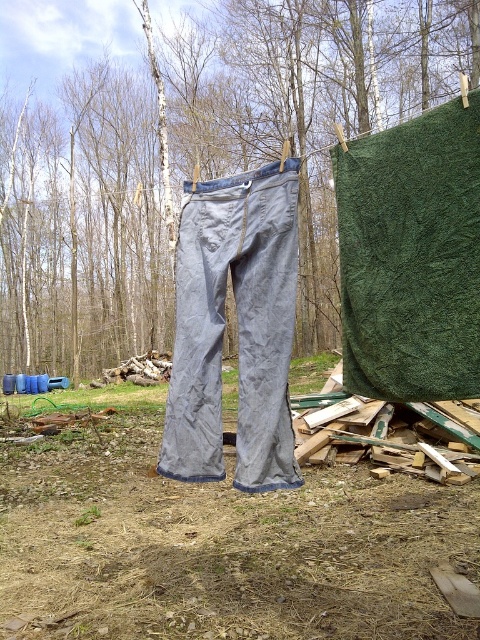
Question: In this image, where is green fabric at center located relative to gray cotton pants at center?

Choices:
 (A) below
 (B) above

Answer: (B)

Question: Among these objects, which one is nearest to the camera?

Choices:
 (A) green fabric at center
 (B) green textured fabric at upper right

Answer: (B)

Question: Which is nearer to the green fabric at center?

Choices:
 (A) gray cotton pants at center
 (B) green textured fabric at upper right

Answer: (A)

Question: Which is nearer to the green fabric at center?

Choices:
 (A) green textured fabric at upper right
 (B) gray cotton pants at center

Answer: (B)

Question: Can you confirm if green fabric at center is thinner than gray cotton pants at center?

Choices:
 (A) yes
 (B) no

Answer: (B)

Question: Does green fabric at center have a larger size compared to gray cotton pants at center?

Choices:
 (A) yes
 (B) no

Answer: (A)